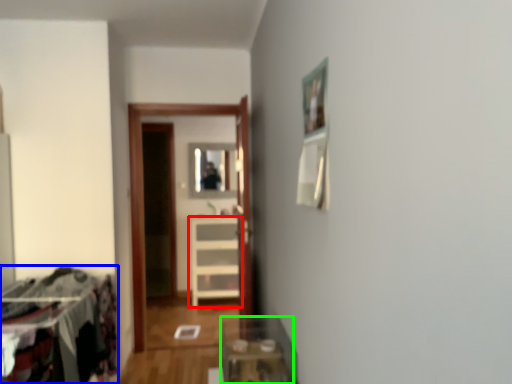
Question: Which is farther away from furniture (highlighted by a red box)? laundry (highlighted by a blue box) or table (highlighted by a green box)?

Choices:
 (A) laundry
 (B) table

Answer: (A)